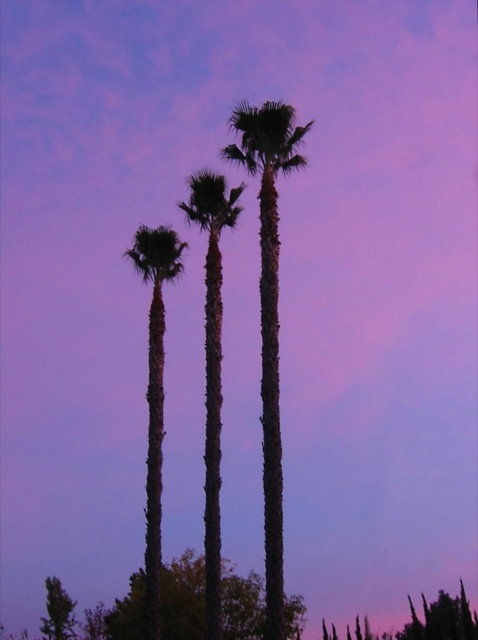
Question: Can you confirm if green textured palm tree at center is positioned to the right of silhouette palm tree at center?

Choices:
 (A) yes
 (B) no

Answer: (A)

Question: Which point is farther from the camera taking this photo?

Choices:
 (A) (212, 412)
 (B) (272, 221)
 (C) (119, 611)
 (D) (176, 250)

Answer: (C)

Question: Which of the following is the closest to the observer?

Choices:
 (A) silhouette palm tree at center
 (B) green textured palm tree at center

Answer: (B)

Question: Can you confirm if silhouette bark palm at center is thinner than silhouette palm tree at center?

Choices:
 (A) no
 (B) yes

Answer: (B)

Question: Does green textured palm tree at center appear under silhouette palm tree at center?

Choices:
 (A) yes
 (B) no

Answer: (A)

Question: Which point is closer to the camera?

Choices:
 (A) (288, 109)
 (B) (215, 620)
 (C) (162, 612)

Answer: (B)